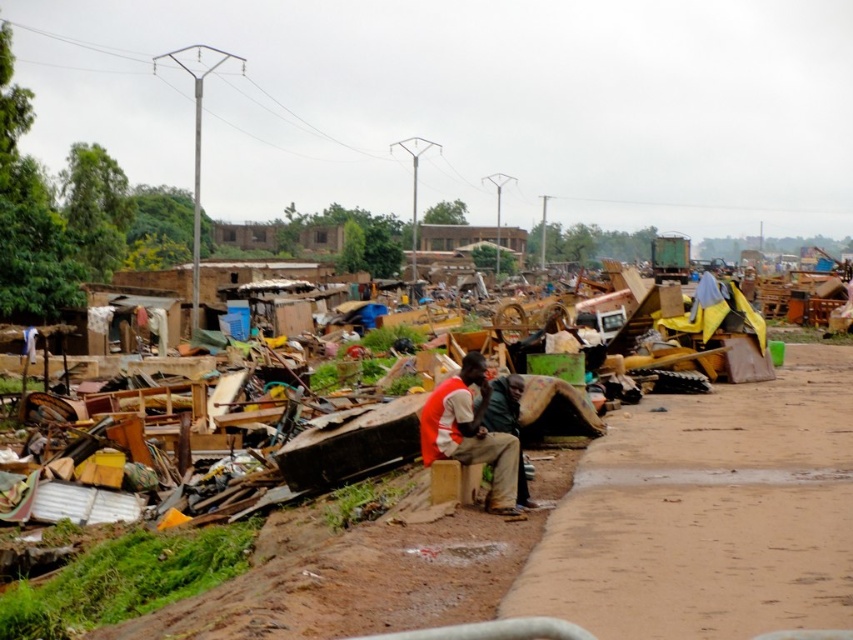
You are a rescue worker trying to reach the orange fabric shirt at center from the brown dirt pavement at lower right. Can you safely walk directly between them if your average step length is 0.75 meters?

The distance between the brown dirt pavement at lower right and the orange fabric shirt at center is 2.57 meters. Since each step is 0.75 meters, you would need approximately 3.43 steps. This is feasible as the path is likely clear given the scene description, so yes, you can safely walk directly between them.

You are a survivor in this disaster zone needing to cross from the debris field to the makeshift bench. The brown dirt pavement at lower right and the orange fabric shirt at center are in your path. Which path has a wider surface to walk on?

The brown dirt pavement at lower right has a wider surface to walk on because its width surpasses that of the orange fabric shirt at center.